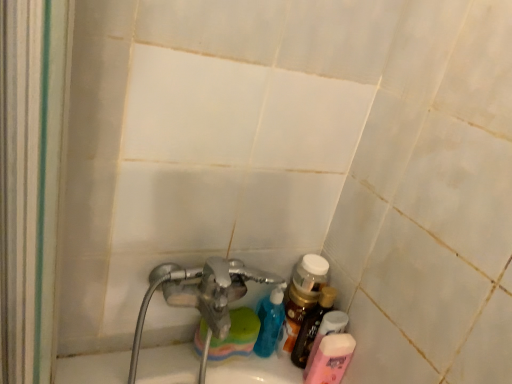
Image resolution: width=512 pixels, height=384 pixels. Describe the element at coordinates (312, 326) in the screenshot. I see `translucent plastic bottle at lower right` at that location.

At what (x,y) coordinates should I click in order to perform the action: click on translucent plastic bottle at lower right. Please return your answer as a coordinate pair (x, y). Looking at the image, I should click on (312, 326).

Considering their positions, is translucent plastic bottle at lower right, the 1th toiletry when ordered from top to bottom, located in front of or behind translucent plastic bottle at lower right?

Visually, translucent plastic bottle at lower right, the 1th toiletry when ordered from top to bottom, is located in front of translucent plastic bottle at lower right.

From the picture: Can you confirm if translucent plastic bottle at lower right, placed as the 2th toiletry when sorted from bottom to top, is wider than translucent plastic bottle at lower right?

Yes, translucent plastic bottle at lower right, placed as the 2th toiletry when sorted from bottom to top, is wider than translucent plastic bottle at lower right.

This screenshot has height=384, width=512. In order to click on bottle above the translucent plastic bottle at lower right, the 1th toiletry when ordered from top to bottom (from a real-world perspective) in this screenshot , I will do `click(312, 326)`.

Considering the sizes of translucent plastic bottle at lower right and pink matte lotion at lower right, marked as the first toiletry in a bottom-to-top arrangement, in the image, is translucent plastic bottle at lower right taller or shorter than pink matte lotion at lower right, marked as the first toiletry in a bottom-to-top arrangement,?

translucent plastic bottle at lower right is taller than pink matte lotion at lower right, marked as the first toiletry in a bottom-to-top arrangement.

Is translucent plastic bottle at lower right touching pink matte lotion at lower right, the 2th toiletry positioned from the top?

Yes, translucent plastic bottle at lower right is beside pink matte lotion at lower right, the 2th toiletry positioned from the top.

Between translucent plastic bottle at lower right and pink matte lotion at lower right, marked as the first toiletry in a bottom-to-top arrangement, which one appears on the left side from the viewer's perspective?

translucent plastic bottle at lower right.

Can you tell me how much translucent plastic bottle at lower right and pink matte lotion at lower right, the 2th toiletry positioned from the top, differ in facing direction?

They differ by 0.00418 degrees in their facing directions.

Between pink matte lotion at lower right, marked as the first toiletry in a bottom-to-top arrangement, and translucent plastic bottle at lower right, the 1th toiletry when ordered from top to bottom, which one is positioned behind?

translucent plastic bottle at lower right, the 1th toiletry when ordered from top to bottom.

From a real-world perspective, is pink matte lotion at lower right, the 2th toiletry positioned from the top, located beneath translucent plastic bottle at lower right, the 1th toiletry when ordered from top to bottom?

Yes.

Is pink matte lotion at lower right, the 2th toiletry positioned from the top, far from translucent plastic bottle at lower right, the 1th toiletry when ordered from top to bottom?

No.

Considering the sizes of pink matte lotion at lower right, the 2th toiletry positioned from the top, and translucent plastic bottle at lower right, placed as the 2th toiletry when sorted from bottom to top, in the image, is pink matte lotion at lower right, the 2th toiletry positioned from the top, wider or thinner than translucent plastic bottle at lower right, placed as the 2th toiletry when sorted from bottom to top,?

pink matte lotion at lower right, the 2th toiletry positioned from the top, is wider than translucent plastic bottle at lower right, placed as the 2th toiletry when sorted from bottom to top.

Considering the sizes of translucent plastic bottle at lower right and translucent plastic bottle at lower right, placed as the 2th toiletry when sorted from bottom to top, in the image, is translucent plastic bottle at lower right bigger or smaller than translucent plastic bottle at lower right, placed as the 2th toiletry when sorted from bottom to top,?

Considering their sizes, translucent plastic bottle at lower right takes up more space than translucent plastic bottle at lower right, placed as the 2th toiletry when sorted from bottom to top.

Find the location of a particular element. The image size is (512, 384). the 1st toiletry below the translucent plastic bottle at lower right (from the image's perspective) is located at coordinates (327, 332).

Is translucent plastic bottle at lower right behind translucent plastic bottle at lower right, placed as the 2th toiletry when sorted from bottom to top?

That is True.

Is pink matte lotion at lower right, marked as the first toiletry in a bottom-to-top arrangement, completely or partially outside of translucent plastic bottle at lower right?

pink matte lotion at lower right, marked as the first toiletry in a bottom-to-top arrangement, lies outside translucent plastic bottle at lower right's area.

Which point is more distant from viewer, (337,336) or (298,338)?

Positioned behind is point (298,338).

How many degrees apart are the facing directions of pink matte lotion at lower right, the 2th toiletry positioned from the top, and translucent plastic bottle at lower right?

The facing directions of pink matte lotion at lower right, the 2th toiletry positioned from the top, and translucent plastic bottle at lower right are 0.00418 degrees apart.

Is the surface of translucent plastic bottle at lower right, placed as the 2th toiletry when sorted from bottom to top, in direct contact with pink matte lotion at lower right, the 2th toiletry positioned from the top?

Yes, translucent plastic bottle at lower right, placed as the 2th toiletry when sorted from bottom to top, is in contact with pink matte lotion at lower right, the 2th toiletry positioned from the top.

Who is smaller, translucent plastic bottle at lower right, placed as the 2th toiletry when sorted from bottom to top, or pink matte lotion at lower right, the 2th toiletry positioned from the top?

Smaller between the two is translucent plastic bottle at lower right, placed as the 2th toiletry when sorted from bottom to top.

From the image's perspective, does translucent plastic bottle at lower right, placed as the 2th toiletry when sorted from bottom to top, appear lower than pink matte lotion at lower right, the 2th toiletry positioned from the top?

No, from the image's perspective, translucent plastic bottle at lower right, placed as the 2th toiletry when sorted from bottom to top, is not beneath pink matte lotion at lower right, the 2th toiletry positioned from the top.

From a real-world perspective, is translucent plastic bottle at lower right, placed as the 2th toiletry when sorted from bottom to top, on top of pink matte lotion at lower right, the 2th toiletry positioned from the top?

Indeed, from a real-world perspective, translucent plastic bottle at lower right, placed as the 2th toiletry when sorted from bottom to top, stands above pink matte lotion at lower right, the 2th toiletry positioned from the top.

Find the location of `toiletry that is the 1st object located in front of the translucent plastic bottle at lower right`. toiletry that is the 1st object located in front of the translucent plastic bottle at lower right is located at coordinates (327, 332).

What are the coordinates of `bottle lying on the left of pink matte lotion at lower right, marked as the first toiletry in a bottom-to-top arrangement` in the screenshot? It's located at (312, 326).

Which object lies further to the anchor point translucent plastic bottle at lower right, translucent plastic bottle at lower right, the 1th toiletry when ordered from top to bottom, or pink matte lotion at lower right, marked as the first toiletry in a bottom-to-top arrangement?

pink matte lotion at lower right, marked as the first toiletry in a bottom-to-top arrangement, is positioned further to the anchor translucent plastic bottle at lower right.

Looking at the image, which one is located further to translucent plastic bottle at lower right, pink matte lotion at lower right, marked as the first toiletry in a bottom-to-top arrangement, or translucent plastic bottle at lower right, the 1th toiletry when ordered from top to bottom?

Based on the image, pink matte lotion at lower right, marked as the first toiletry in a bottom-to-top arrangement, appears to be further to translucent plastic bottle at lower right.

Looking at this image, based on their spatial positions, is pink matte lotion at lower right, the 2th toiletry positioned from the top, or translucent plastic bottle at lower right closer to translucent plastic bottle at lower right, the 1th toiletry when ordered from top to bottom?

Based on the image, pink matte lotion at lower right, the 2th toiletry positioned from the top, appears to be nearer to translucent plastic bottle at lower right, the 1th toiletry when ordered from top to bottom.

From the image, which object appears to be farther from translucent plastic bottle at lower right, placed as the 2th toiletry when sorted from bottom to top, translucent plastic bottle at lower right or pink matte lotion at lower right, the 2th toiletry positioned from the top?

translucent plastic bottle at lower right.

Which object lies nearer to the anchor point pink matte lotion at lower right, the 2th toiletry positioned from the top, translucent plastic bottle at lower right or translucent plastic bottle at lower right, placed as the 2th toiletry when sorted from bottom to top?

translucent plastic bottle at lower right, placed as the 2th toiletry when sorted from bottom to top.

From the image, which object appears to be nearer to pink matte lotion at lower right, the 2th toiletry positioned from the top, translucent plastic bottle at lower right, the 1th toiletry when ordered from top to bottom, or translucent plastic bottle at lower right?

translucent plastic bottle at lower right, the 1th toiletry when ordered from top to bottom.

The image size is (512, 384). Identify the location of toiletry between translucent plastic bottle at lower right and pink matte lotion at lower right, marked as the first toiletry in a bottom-to-top arrangement, in the vertical direction. (327, 332).